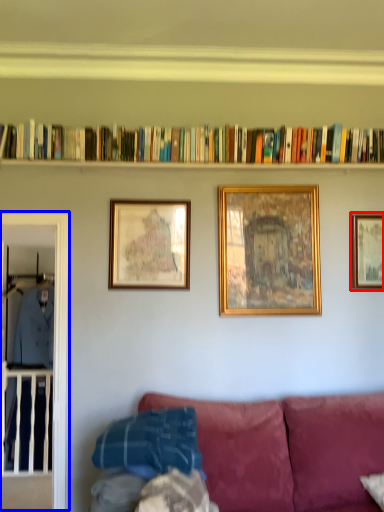
Question: Which point is further to the camera, picture frame (highlighted by a red box) or glass door (highlighted by a blue box)?

Choices:
 (A) picture frame
 (B) glass door

Answer: (A)